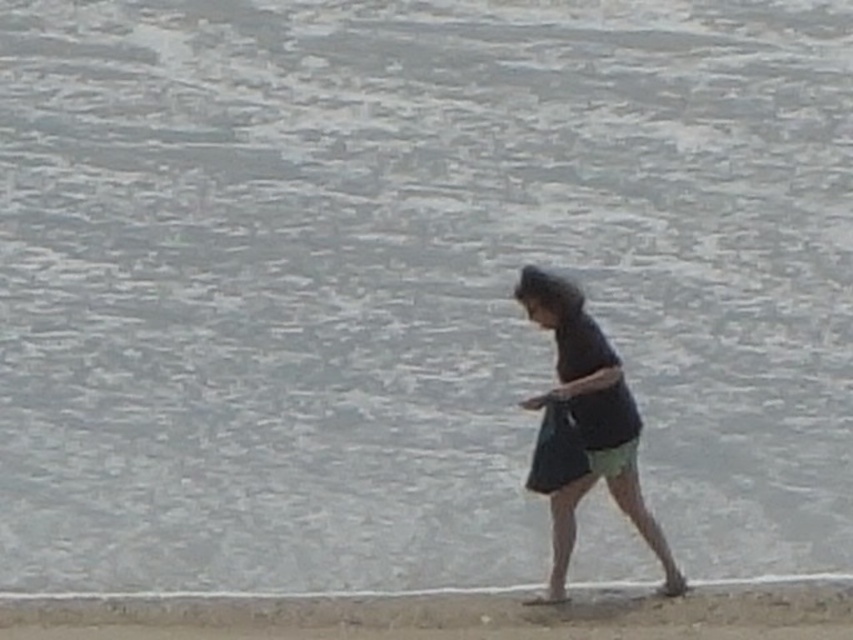
How distant is sandy beach at lower center from dark matte shirt at center?

They are 99.59 centimeters apart.

Looking at this image, is sandy beach at lower center to the right of dark matte shirt at center from the viewer's perspective?

Incorrect, sandy beach at lower center is not on the right side of dark matte shirt at center.

Is point (375, 628) behind point (549, 492)?

No, (375, 628) is closer to viewer.

What are the coordinates of `sandy beach at lower center` in the screenshot? It's located at (451, 614).